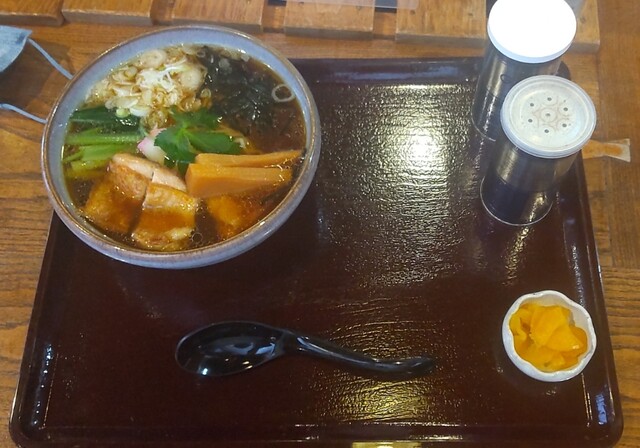
I want to click on wooden table, so click(x=20, y=236).